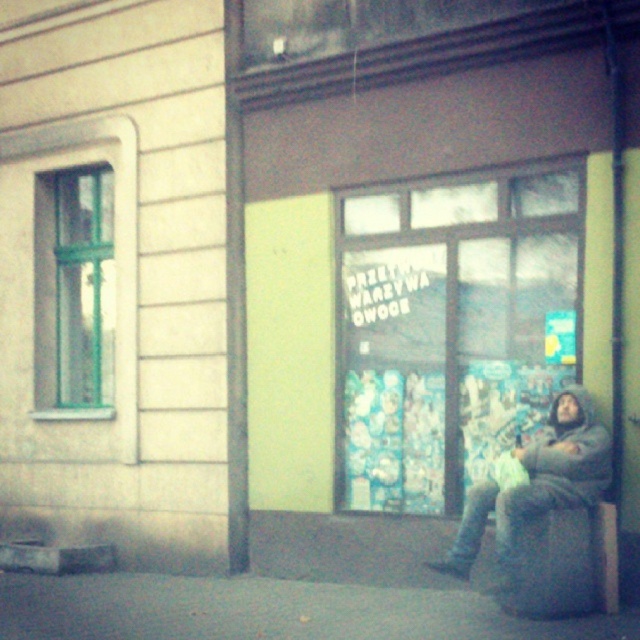
Question: Is fuzzy gray coat at lower right thinner than gray fabric stool at lower right?

Choices:
 (A) no
 (B) yes

Answer: (A)

Question: Which object appears farthest from the camera in this image?

Choices:
 (A) gray fabric stool at lower right
 (B) fuzzy gray coat at lower right

Answer: (A)

Question: Observing the image, what is the correct spatial positioning of fuzzy gray coat at lower right in reference to gray fabric stool at lower right?

Choices:
 (A) above
 (B) below

Answer: (A)

Question: Which point is closer to the camera taking this photo?

Choices:
 (A) (588, 516)
 (B) (472, 493)

Answer: (A)

Question: Where is fuzzy gray coat at lower right located in relation to gray fabric stool at lower right in the image?

Choices:
 (A) below
 (B) above

Answer: (B)